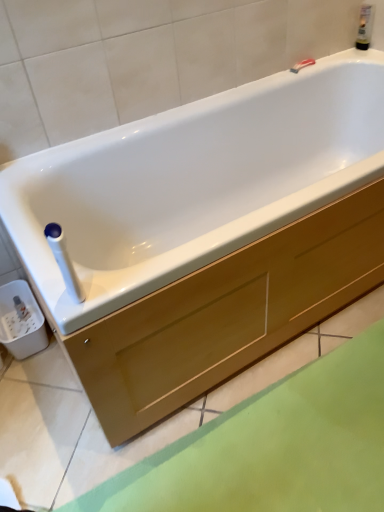
Question: Considering the positions of white plastic towel bar at upper left and translucent plastic bottle at upper right in the image, is white plastic towel bar at upper left taller or shorter than translucent plastic bottle at upper right?

Choices:
 (A) tall
 (B) short

Answer: (A)

Question: Is white plastic towel bar at upper left to the left or to the right of translucent plastic bottle at upper right in the image?

Choices:
 (A) right
 (B) left

Answer: (B)

Question: Considering the real-world distances, which object is closest to the translucent plastic bottle at upper right?

Choices:
 (A) white plastic towel bar at upper left
 (B) matte wood drawer at center

Answer: (B)

Question: Based on their relative distances, which object is nearer to the matte wood drawer at center?

Choices:
 (A) white plastic towel bar at upper left
 (B) translucent plastic bottle at upper right

Answer: (A)